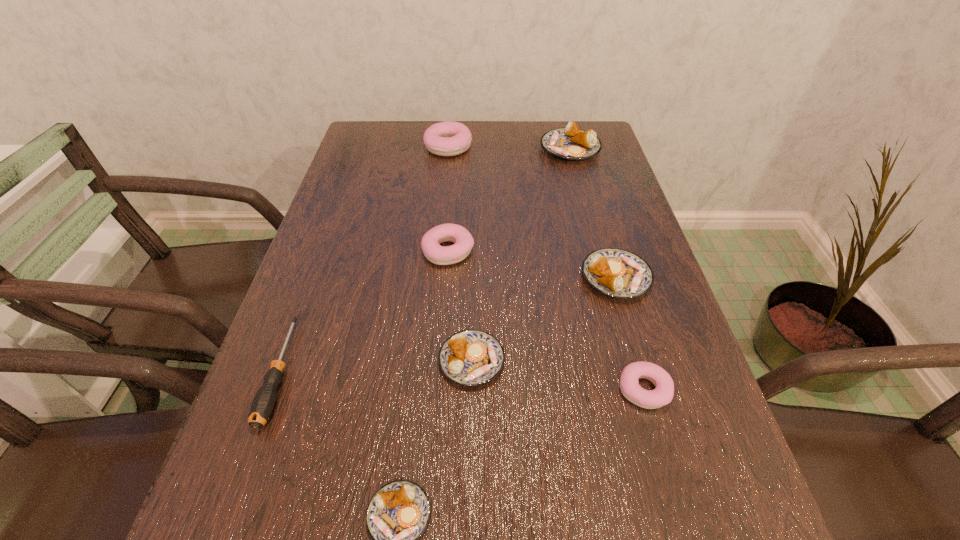
You are a GUI agent. You are given a task and a screenshot of the screen. Output one action in this format:
    pyautogui.click(x=<x>, y=<y>)
    Task: Click on the farthest brown pastry
    This screenshot has width=960, height=540.
    Given the screenshot: What is the action you would take?
    pyautogui.click(x=572, y=143)

Identify the location of the farthest pink pastry. This screenshot has width=960, height=540. (448, 138).

Where is `the third nearest brown pastry`? the third nearest brown pastry is located at coordinates (618, 273).

Find the location of a particular element. Image resolution: width=960 pixels, height=540 pixels. the second biggest pink pastry is located at coordinates (434, 252).

Where is `the second smallest brown pastry`? the second smallest brown pastry is located at coordinates (470, 357).

Identify the location of screwdriver. (263, 403).

Where is `the nearest pink pastry`? Image resolution: width=960 pixels, height=540 pixels. the nearest pink pastry is located at coordinates (662, 395).

Find the location of a particular element. The height and width of the screenshot is (540, 960). the rightmost pink pastry is located at coordinates (662, 395).

I want to click on free space located 0.240m on the front of the farthest brown pastry, so click(x=588, y=218).

Locate an element on the screen. This screenshot has height=540, width=960. vacant region located on the front of the farthest pink pastry is located at coordinates (439, 240).